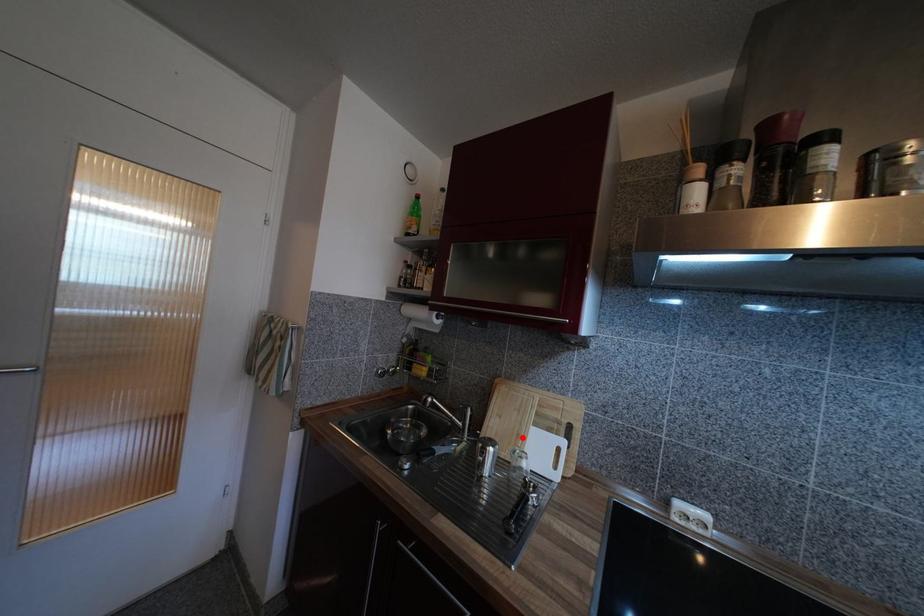
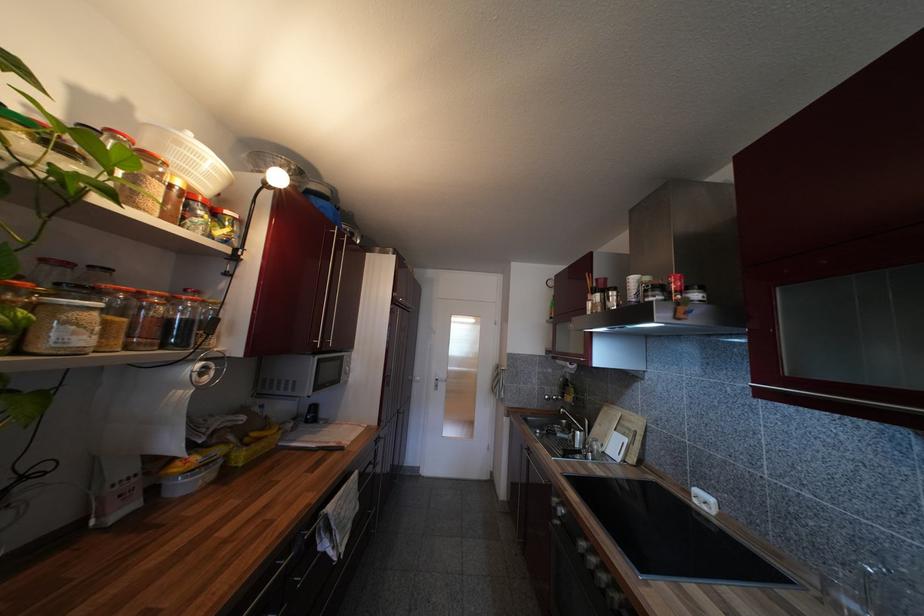
Locate, in the second image, the point that corresponds to the highlighted location in the first image.

(610, 438)